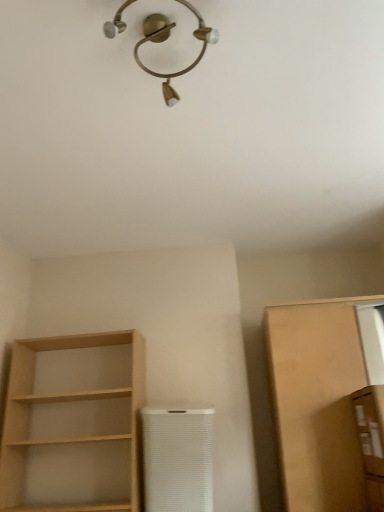
Describe the element at coordinates (317, 402) in the screenshot. I see `matte brown cabinet at right, acting as the 2th cabinetry starting from the front` at that location.

What do you see at coordinates (178, 459) in the screenshot?
I see `white textured air purifier at center` at bounding box center [178, 459].

The image size is (384, 512). In order to click on matte brown cabinet at right, acting as the 2th cabinetry starting from the front in this screenshot , I will do `click(317, 402)`.

Does white textured air purifier at center have a larger size compared to brown cardboard box at right, which is the first cabinetry from front to back?

Indeed, white textured air purifier at center has a larger size compared to brown cardboard box at right, which is the first cabinetry from front to back.

From a real-world perspective, which cabinetry is the 1st one above the white textured air purifier at center? Please provide its 2D coordinates.

[(371, 441)]

Based on the photo, considering the relative sizes of white textured air purifier at center and brown cardboard box at right, the second cabinetry viewed from the back, in the image provided, is white textured air purifier at center wider than brown cardboard box at right, the second cabinetry viewed from the back,?

No.

From the image's perspective, does white textured air purifier at center appear lower than brown cardboard box at right, the second cabinetry viewed from the back?

Yes, from the image's perspective, white textured air purifier at center is below brown cardboard box at right, the second cabinetry viewed from the back.

Can white textured air purifier at center be found inside matte brown cabinet at right, acting as the 2th cabinetry starting from the front?

Actually, white textured air purifier at center is outside matte brown cabinet at right, acting as the 2th cabinetry starting from the front.

What's the angular difference between matte brown cabinet at right, the first cabinetry viewed from the back, and white textured air purifier at center's facing directions?

0.242 degrees.

Which object is closer to the camera, matte brown cabinet at right, the first cabinetry viewed from the back, or white textured air purifier at center?

matte brown cabinet at right, the first cabinetry viewed from the back, is more forward.

Where is `shelf positioned vertically above the white textured air purifier at center (from a real-world perspective)`? shelf positioned vertically above the white textured air purifier at center (from a real-world perspective) is located at coordinates (74, 423).

From a real-world perspective, which object rests below the other?

white textured air purifier at center, from a real-world perspective.

Is white textured air purifier at center directly adjacent to light wood shelf at left?

No, white textured air purifier at center is not touching light wood shelf at left.

From the image's perspective, is brown cardboard box at right, the second cabinetry viewed from the back, positioned above or below light wood shelf at left?

Clearly, from the image's perspective, brown cardboard box at right, the second cabinetry viewed from the back, is above light wood shelf at left.

Is brown cardboard box at right, the second cabinetry viewed from the back, beside light wood shelf at left?

No, brown cardboard box at right, the second cabinetry viewed from the back, is not in contact with light wood shelf at left.

From the image's perspective, which cabinetry is the 2nd one above the light wood shelf at left? Please provide its 2D coordinates.

[(371, 441)]

Considering the relative positions of brown cardboard box at right, the second cabinetry viewed from the back, and light wood shelf at left in the image provided, is brown cardboard box at right, the second cabinetry viewed from the back, in front of light wood shelf at left?

Yes, brown cardboard box at right, the second cabinetry viewed from the back, is in front of light wood shelf at left.

From a real-world perspective, which cabinetry is the 1st one underneath the light wood shelf at left? Please provide its 2D coordinates.

[(317, 402)]

Is light wood shelf at left not inside matte brown cabinet at right, acting as the 2th cabinetry starting from the front?

Yes.

From the image's perspective, which is below, light wood shelf at left or matte brown cabinet at right, the first cabinetry viewed from the back?

light wood shelf at left, from the image's perspective.

Considering the relative sizes of light wood shelf at left and matte brown cabinet at right, the first cabinetry viewed from the back, in the image provided, is light wood shelf at left smaller than matte brown cabinet at right, the first cabinetry viewed from the back,?

Yes, light wood shelf at left is smaller than matte brown cabinet at right, the first cabinetry viewed from the back.

In the image, there is a matte brown cabinet at right, the first cabinetry viewed from the back. In order to click on light fixture above it (from the image's perspective) in this screenshot , I will do `click(167, 38)`.

How distant is gold metallic light fixture at upper center from matte brown cabinet at right, the first cabinetry viewed from the back?

gold metallic light fixture at upper center is 1.74 meters away from matte brown cabinet at right, the first cabinetry viewed from the back.

Does gold metallic light fixture at upper center have a lesser width compared to matte brown cabinet at right, the first cabinetry viewed from the back?

Yes.

Considering the relative sizes of gold metallic light fixture at upper center and matte brown cabinet at right, the first cabinetry viewed from the back, in the image provided, is gold metallic light fixture at upper center taller than matte brown cabinet at right, the first cabinetry viewed from the back,?

No.

Is brown cardboard box at right, the second cabinetry viewed from the back, next to white textured air purifier at center and touching it?

brown cardboard box at right, the second cabinetry viewed from the back, is not next to white textured air purifier at center, and they're not touching.

In the image, is brown cardboard box at right, the second cabinetry viewed from the back, positioned in front of or behind white textured air purifier at center?

In the image, brown cardboard box at right, the second cabinetry viewed from the back, appears in front of white textured air purifier at center.

From a real-world perspective, is brown cardboard box at right, the second cabinetry viewed from the back, above or below white textured air purifier at center?

Clearly, from a real-world perspective, brown cardboard box at right, the second cabinetry viewed from the back, is above white textured air purifier at center.

Choose the correct answer: Is brown cardboard box at right, which is the first cabinetry from front to back, inside white textured air purifier at center or outside it?

brown cardboard box at right, which is the first cabinetry from front to back, is located beyond the bounds of white textured air purifier at center.

Find the location of `appliance below the brown cardboard box at right, the second cabinetry viewed from the back (from a real-world perspective)`. appliance below the brown cardboard box at right, the second cabinetry viewed from the back (from a real-world perspective) is located at coordinates (178, 459).

I want to click on cabinetry that is the 1st object located above the white textured air purifier at center (from the image's perspective), so click(x=317, y=402).

When comparing their distances from light wood shelf at left, does matte brown cabinet at right, the first cabinetry viewed from the back, or brown cardboard box at right, which is the first cabinetry from front to back, seem closer?

Based on the image, matte brown cabinet at right, the first cabinetry viewed from the back, appears to be nearer to light wood shelf at left.

Based on the photo, looking at the image, which one is located further to matte brown cabinet at right, the first cabinetry viewed from the back, gold metallic light fixture at upper center or light wood shelf at left?

gold metallic light fixture at upper center lies further to matte brown cabinet at right, the first cabinetry viewed from the back, than the other object.

From the picture: Which object lies further to the anchor point matte brown cabinet at right, acting as the 2th cabinetry starting from the front, light wood shelf at left or gold metallic light fixture at upper center?

The object further to matte brown cabinet at right, acting as the 2th cabinetry starting from the front, is gold metallic light fixture at upper center.

From the image, which object appears to be nearer to matte brown cabinet at right, the first cabinetry viewed from the back, gold metallic light fixture at upper center or white textured air purifier at center?

white textured air purifier at center is closer to matte brown cabinet at right, the first cabinetry viewed from the back.

Looking at the image, which one is located closer to matte brown cabinet at right, acting as the 2th cabinetry starting from the front, brown cardboard box at right, the second cabinetry viewed from the back, or white textured air purifier at center?

Based on the image, brown cardboard box at right, the second cabinetry viewed from the back, appears to be nearer to matte brown cabinet at right, acting as the 2th cabinetry starting from the front.

Which object lies nearer to the anchor point gold metallic light fixture at upper center, light wood shelf at left or brown cardboard box at right, which is the first cabinetry from front to back?

brown cardboard box at right, which is the first cabinetry from front to back, lies closer to gold metallic light fixture at upper center than the other object.

Consider the image. Considering their positions, is white textured air purifier at center positioned closer to matte brown cabinet at right, acting as the 2th cabinetry starting from the front, than light wood shelf at left?

Based on the image, white textured air purifier at center appears to be nearer to matte brown cabinet at right, acting as the 2th cabinetry starting from the front.

When comparing their distances from brown cardboard box at right, the second cabinetry viewed from the back, does white textured air purifier at center or matte brown cabinet at right, the first cabinetry viewed from the back, seem closer?

matte brown cabinet at right, the first cabinetry viewed from the back, lies closer to brown cardboard box at right, the second cabinetry viewed from the back, than the other object.

This screenshot has width=384, height=512. I want to click on appliance between light wood shelf at left and brown cardboard box at right, which is the first cabinetry from front to back, in the horizontal direction, so click(178, 459).

The height and width of the screenshot is (512, 384). Find the location of `cabinetry between gold metallic light fixture at upper center and matte brown cabinet at right, acting as the 2th cabinetry starting from the front, in the up-down direction`. cabinetry between gold metallic light fixture at upper center and matte brown cabinet at right, acting as the 2th cabinetry starting from the front, in the up-down direction is located at coordinates (371, 441).

Locate an element on the screen. This screenshot has height=512, width=384. shelf between gold metallic light fixture at upper center and white textured air purifier at center from top to bottom is located at coordinates (x=74, y=423).

Where is `cabinetry between light wood shelf at left and brown cardboard box at right, which is the first cabinetry from front to back, from left to right`? This screenshot has height=512, width=384. cabinetry between light wood shelf at left and brown cardboard box at right, which is the first cabinetry from front to back, from left to right is located at coordinates (317, 402).